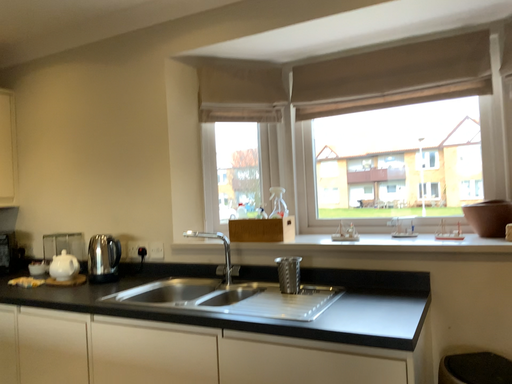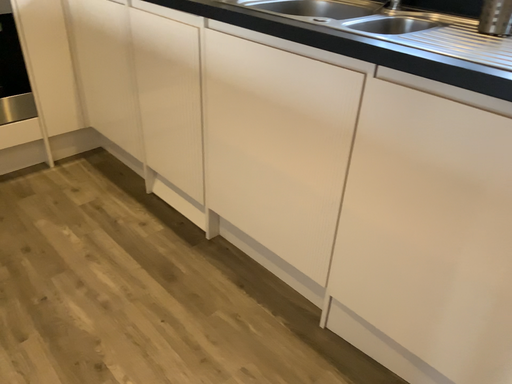
Question: How did the camera likely rotate when shooting the video?

Choices:
 (A) rotated downward
 (B) rotated upward

Answer: (A)